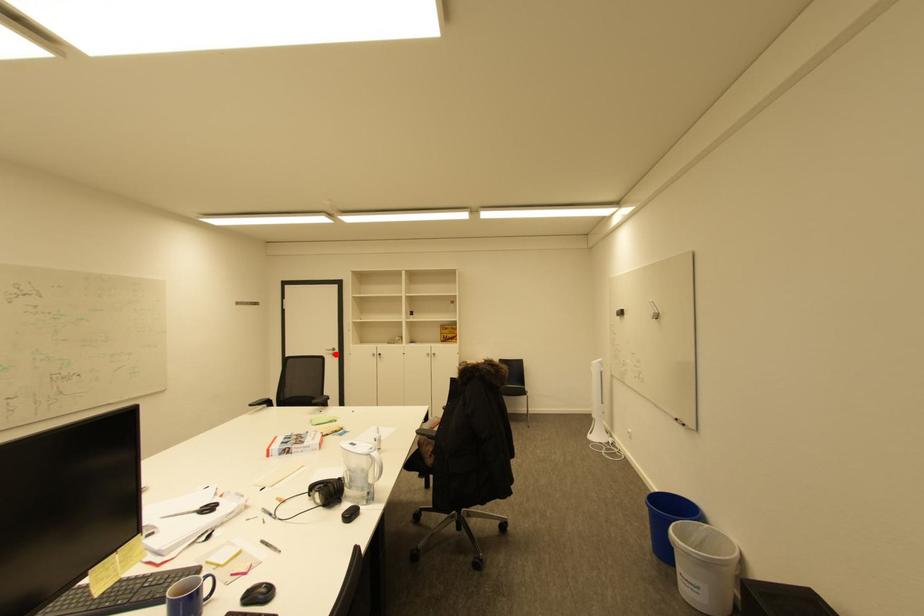
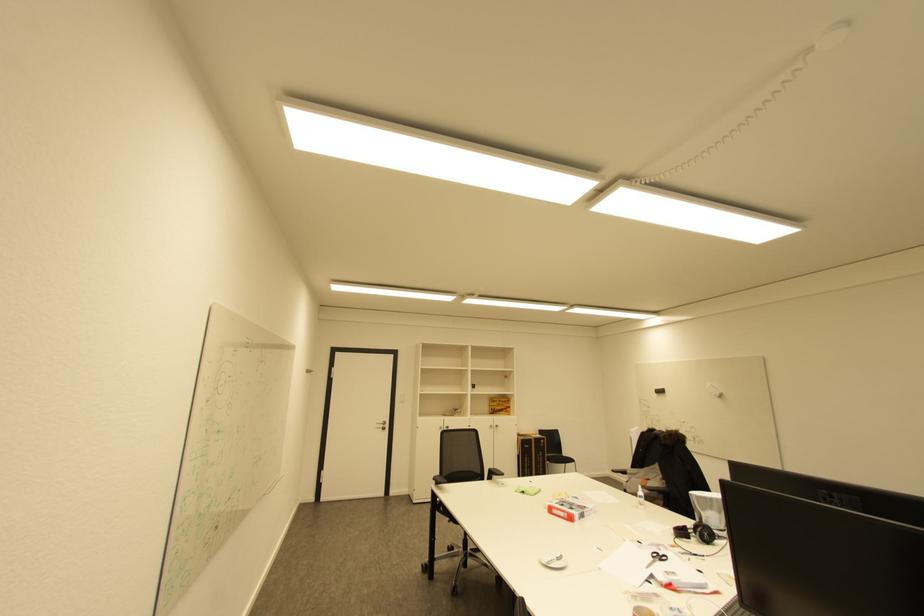
Question: I am providing you with two images of the same scene from different viewpoints. Image1 has a red point marked. In image2, the corresponding 3D location appears at what relative position? Reply with the corresponding letter.

Choices:
 (A) Closer
 (B) Farther

Answer: (B)